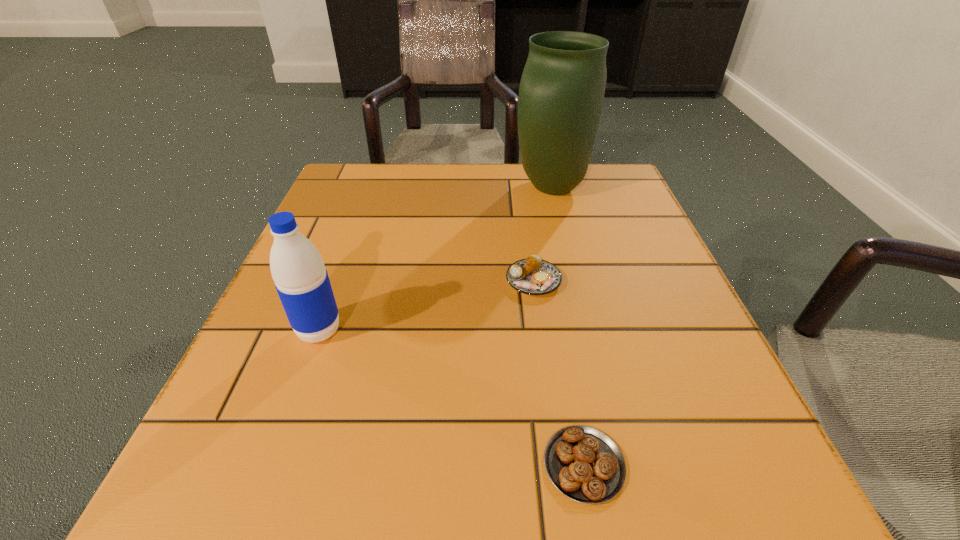
In order to click on vacant area that lies between the water bottle and the nearer pastry in this screenshot , I will do `click(451, 397)`.

At what (x,y) coordinates should I click in order to perform the action: click on vacant space that's between the third farthest object and the second shortest object. Please return your answer as a coordinate pair (x, y). Image resolution: width=960 pixels, height=540 pixels. Looking at the image, I should click on (426, 306).

Point out which object is positioned as the second nearest to the third farthest object. Please provide its 2D coordinates. Your answer should be formatted as a tuple, i.e. [(x, y)], where the tuple contains the x and y coordinates of a point satisfying the conditions above.

[(584, 464)]

Identify which object is located as the nearest to the shortest object. Please provide its 2D coordinates. Your answer should be formatted as a tuple, i.e. [(x, y)], where the tuple contains the x and y coordinates of a point satisfying the conditions above.

[(533, 276)]

Locate an element on the screen. The image size is (960, 540). free region that satisfies the following two spatial constraints: 1. on the back side of the nearer pastry; 2. on the right side of the vase is located at coordinates (534, 187).

Where is `vacant space that satisfies the following two spatial constraints: 1. on the back side of the tallest object; 2. on the left side of the third tallest object`? vacant space that satisfies the following two spatial constraints: 1. on the back side of the tallest object; 2. on the left side of the third tallest object is located at coordinates (520, 187).